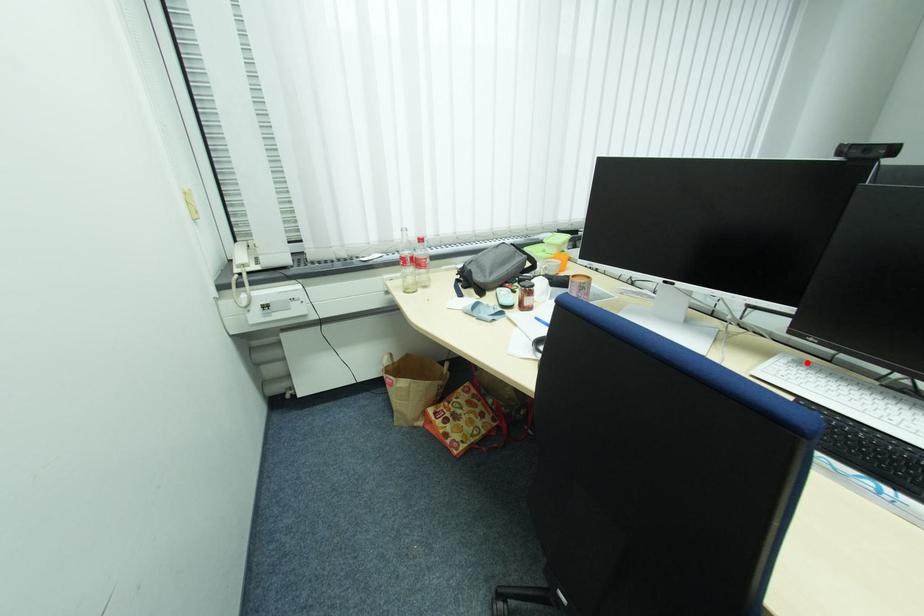
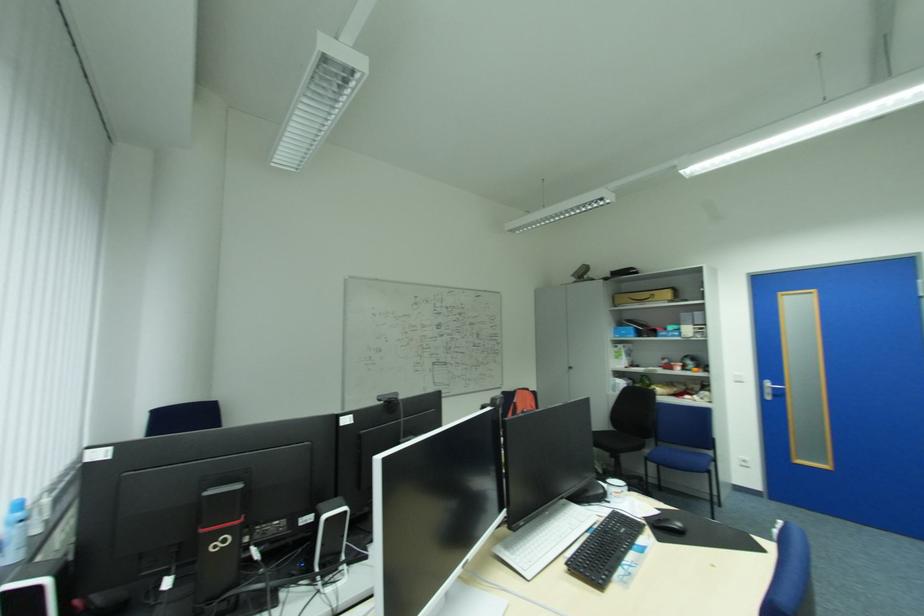
Question: I am providing you with two images of the same scene from different viewpoints. A red point is shown in image1. For the corresponding object point in image2, is it positioned nearer or farther from the camera?

Choices:
 (A) Nearer
 (B) Farther

Answer: (B)